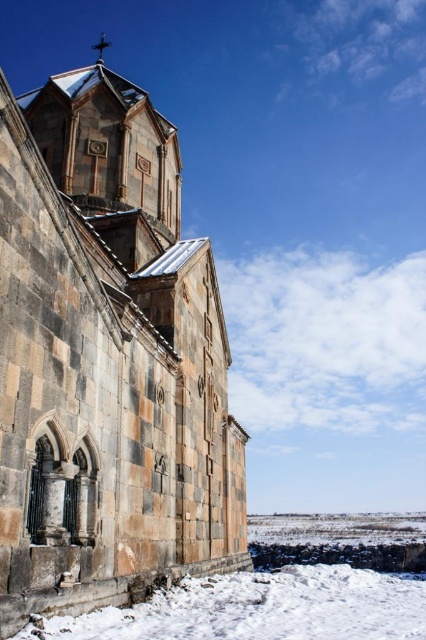
Question: Is rustic stone church at center wider than white powdery snow at lower center?

Choices:
 (A) no
 (B) yes

Answer: (B)

Question: Observing the image, what is the correct spatial positioning of rustic stone church at center in reference to white powdery snow at lower center?

Choices:
 (A) below
 (B) above

Answer: (B)

Question: Which object appears farthest from the camera in this image?

Choices:
 (A) white powdery snow at lower center
 (B) rustic stone church at center

Answer: (B)

Question: Which of the following is the closest to the observer?

Choices:
 (A) (34, 390)
 (B) (204, 589)

Answer: (A)

Question: Can you confirm if rustic stone church at center is smaller than white powdery snow at lower center?

Choices:
 (A) yes
 (B) no

Answer: (B)